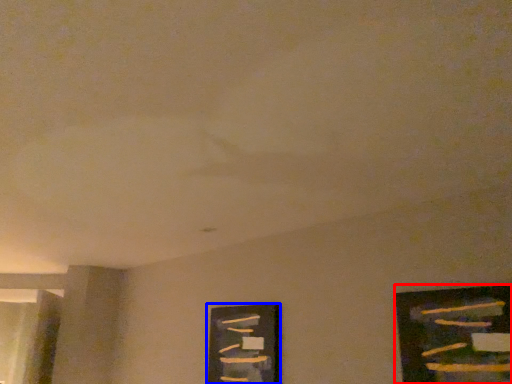
Question: Which point is closer to the camera, picture frame (highlighted by a red box) or picture frame (highlighted by a blue box)?

Choices:
 (A) picture frame
 (B) picture frame

Answer: (A)